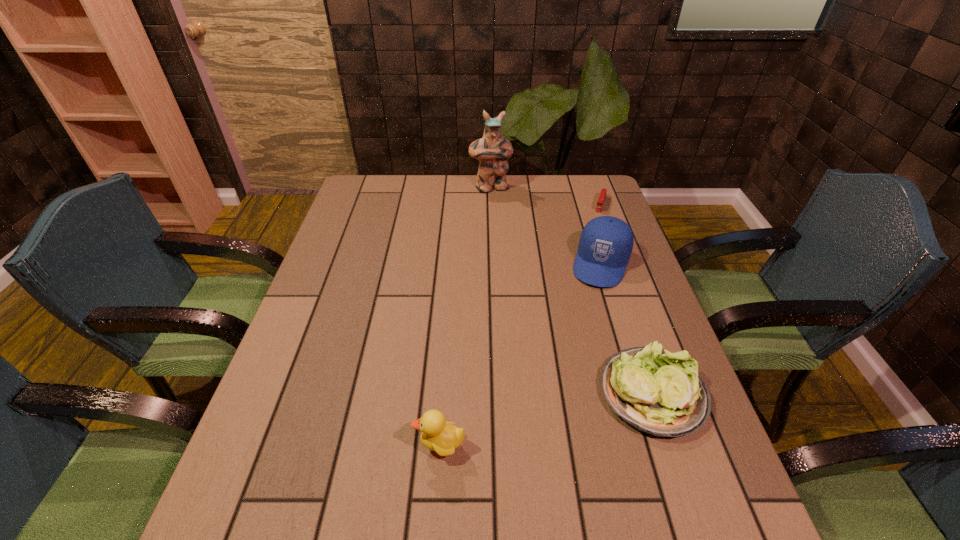
Where is `duckling`? duckling is located at coordinates (443, 438).

This screenshot has height=540, width=960. Identify the location of the second shortest object. click(657, 392).

In order to click on figurine in this screenshot , I will do `click(492, 150)`.

The height and width of the screenshot is (540, 960). In order to click on the farthest object in this screenshot , I will do `click(492, 150)`.

Identify the location of the third farthest object. The image size is (960, 540). (606, 243).

I want to click on stapler, so click(x=600, y=203).

You are a GUI agent. You are given a task and a screenshot of the screen. Output one action in this format:
    pyautogui.click(x=<x>, y=<y>)
    Task: Click on the shortest object
    
    Given the screenshot: What is the action you would take?
    pyautogui.click(x=600, y=203)

Find the location of a particular element. free space located on the front-facing side of the duckling is located at coordinates [x=359, y=447].

Locate an element on the screen. free space located on the front-facing side of the duckling is located at coordinates (262, 447).

Where is `free space located on the front-facing side of the duckling`? free space located on the front-facing side of the duckling is located at coordinates (313, 447).